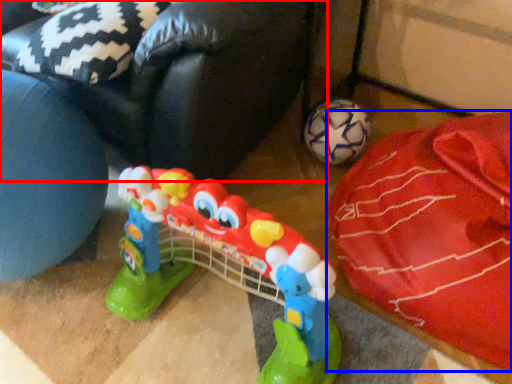
Question: Which of the following is the farthest to the observer, bean bag chair (highlighted by a red box) or material (highlighted by a blue box)?

Choices:
 (A) bean bag chair
 (B) material

Answer: (A)